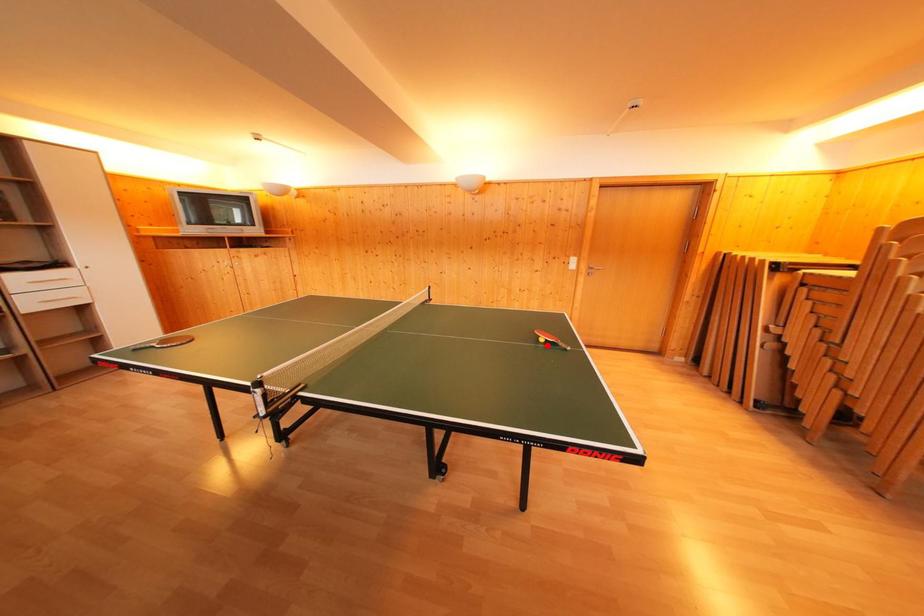
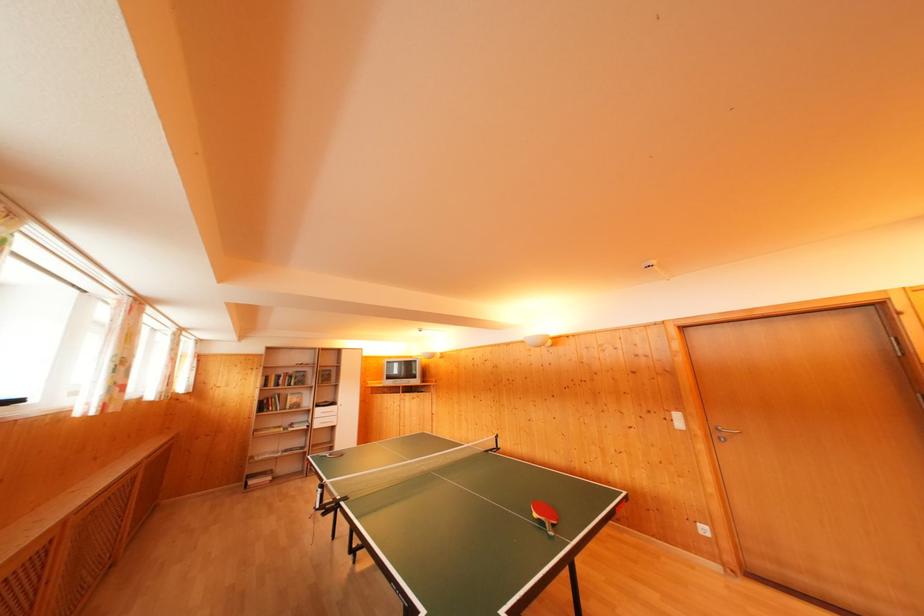
In the second image, find the point that corresponds to the highlighted location in the first image.

(541, 521)